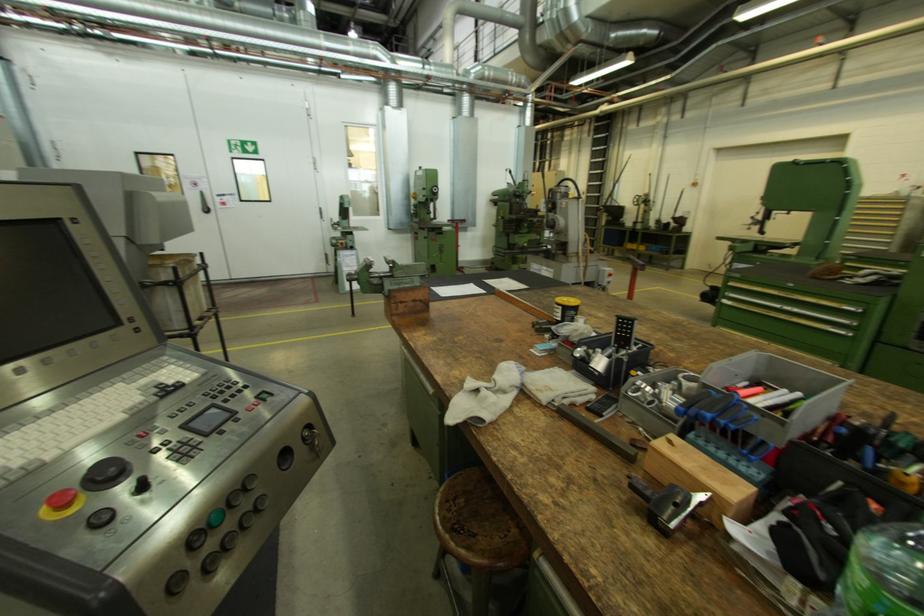
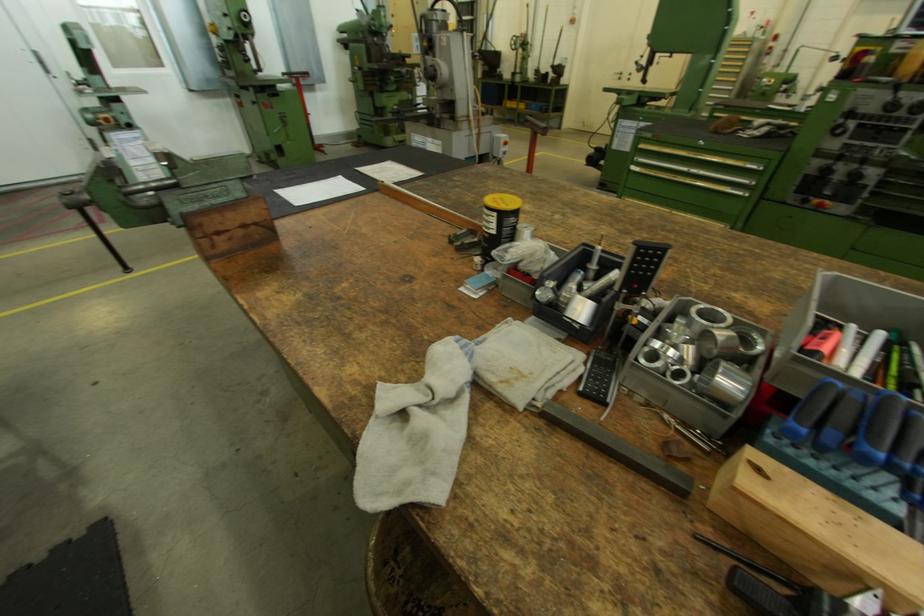
In the second image, find the point that corresponds to (646,435) in the first image.

(673, 424)